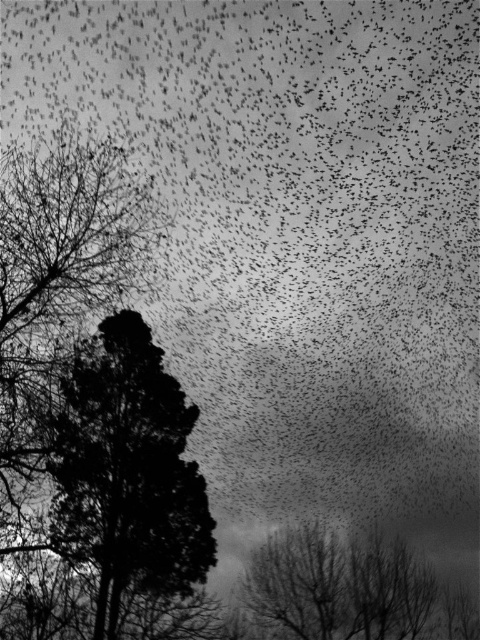
Is black textured tree at center behind bare branches at lower center?

No, it is in front of bare branches at lower center.

Who is taller, black textured tree at center or bare branches at lower center?

black textured tree at center is taller.

Where is `black textured tree at center`? Image resolution: width=480 pixels, height=640 pixels. black textured tree at center is located at coordinates (128, 472).

Identify the location of black textured tree at center. The width and height of the screenshot is (480, 640). (128, 472).